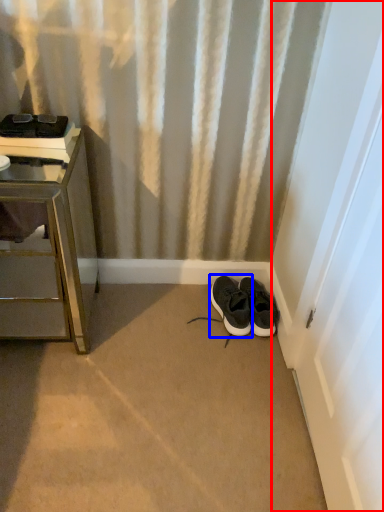
Question: Among these objects, which one is nearest to the camera, screen door (highlighted by a red box) or footwear (highlighted by a blue box)?

Choices:
 (A) screen door
 (B) footwear

Answer: (A)